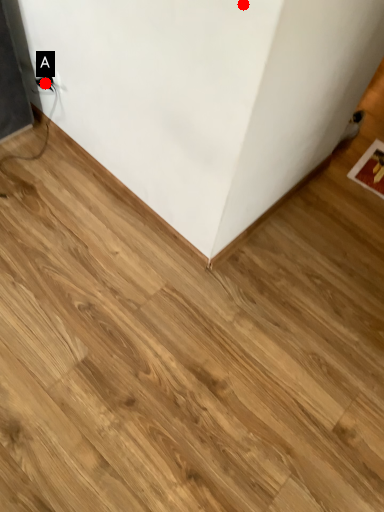
Question: Two points are circled on the image, labeled by A and B beside each circle. Among these points, which one is farthest from the camera?

Choices:
 (A) A is further
 (B) B is further

Answer: (A)